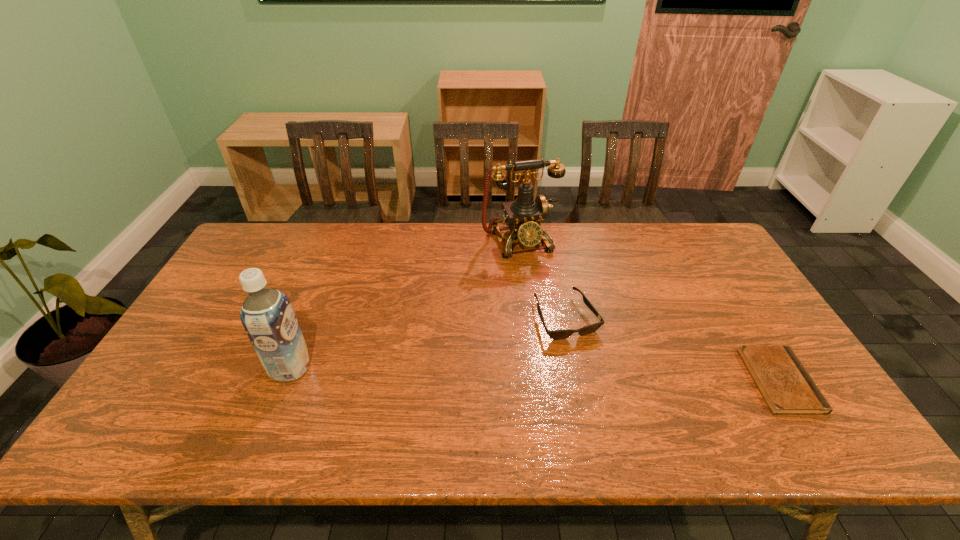
Locate an element on the screen. The image size is (960, 540). free location located on the front of the telephone, featuring the rotary dial is located at coordinates (557, 314).

Identify the location of vacant point located on the front of the telephone, featuring the rotary dial. (544, 288).

Image resolution: width=960 pixels, height=540 pixels. I want to click on vacant point located 0.130m on the front-facing side of the sunglasses, so click(x=600, y=383).

The height and width of the screenshot is (540, 960). Find the location of `vacant space located on the front-facing side of the sunglasses`. vacant space located on the front-facing side of the sunglasses is located at coordinates (614, 411).

Identify the location of vacant space located on the front-facing side of the sunglasses. (594, 373).

Where is `object that is at the far edge`? This screenshot has height=540, width=960. object that is at the far edge is located at coordinates (524, 215).

I want to click on soya milk that is at the near edge, so click(x=267, y=316).

Identify the location of diary at the near edge. Image resolution: width=960 pixels, height=540 pixels. (787, 388).

Identify the location of object that is at the right edge. The height and width of the screenshot is (540, 960). (787, 388).

Find the location of a particular element. object that is positioned at the near right corner is located at coordinates pyautogui.click(x=787, y=388).